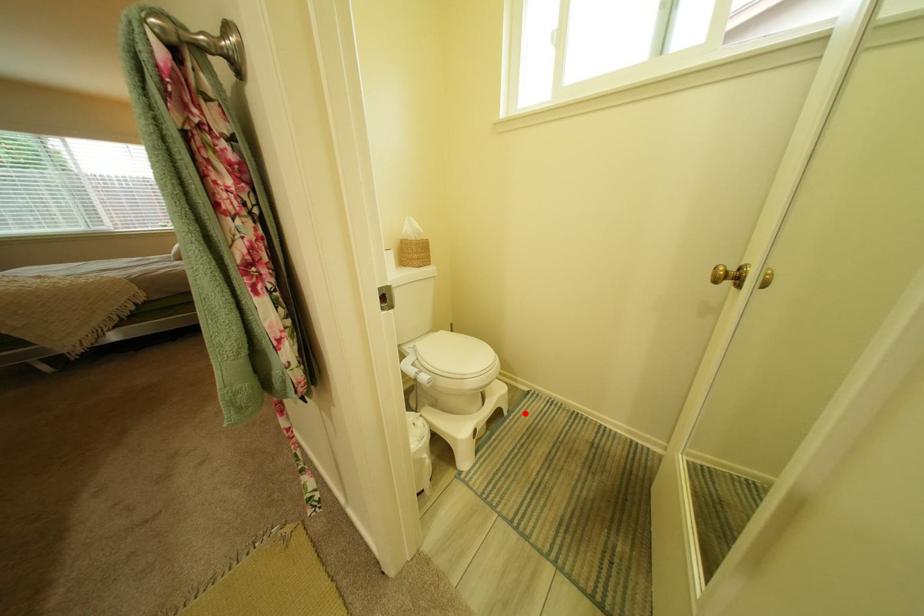
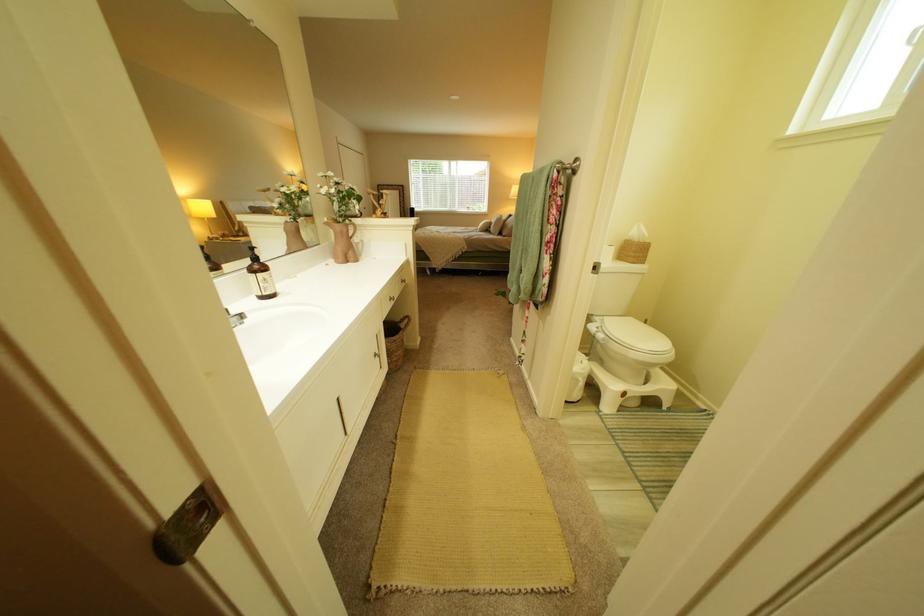
Where in the second image is the point corresponding to the highlighted location from the first image?

(685, 410)